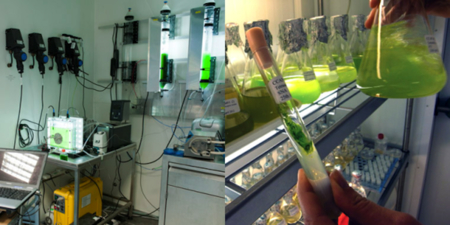
Identify the location of laptop keyboard. [x=15, y=194].